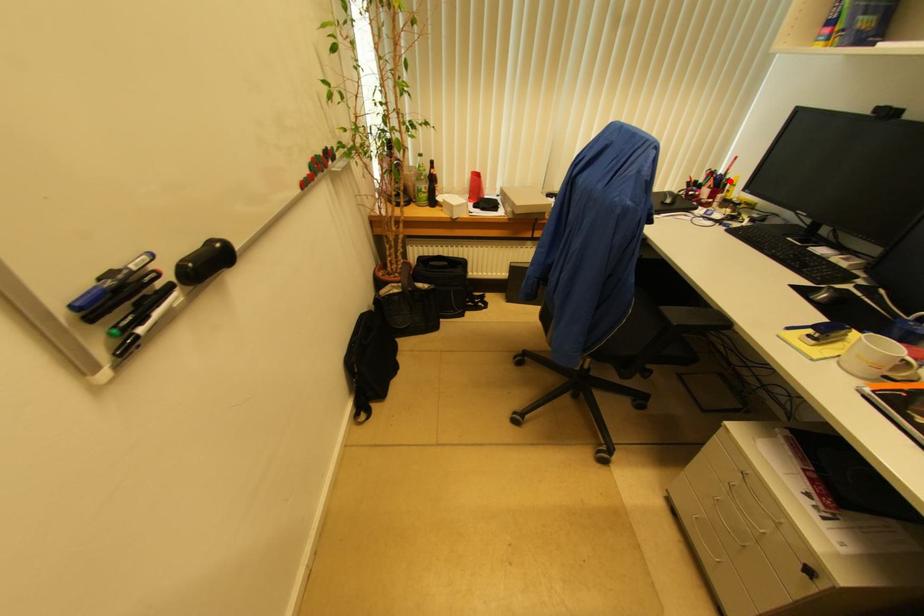
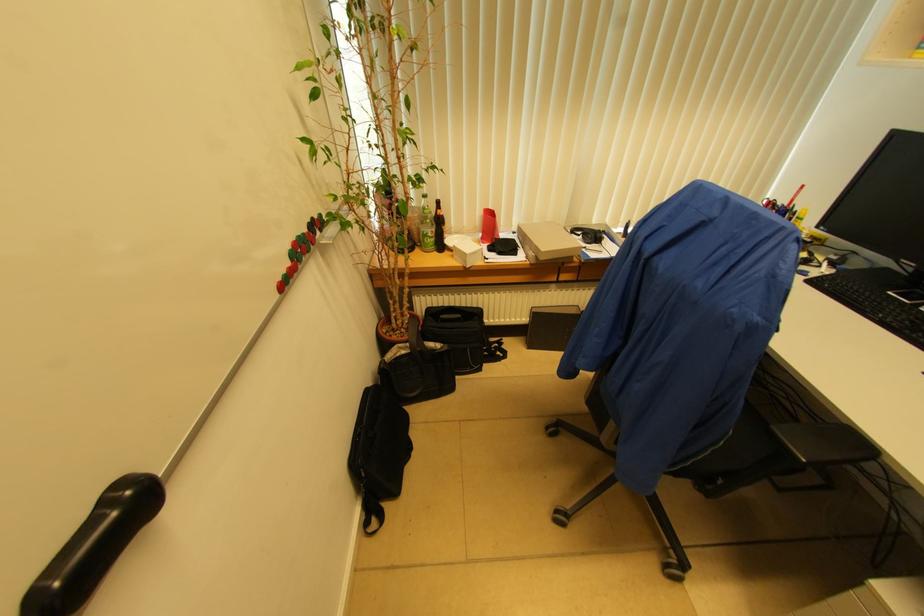
Question: I am providing you with two images of the same scene from different viewpoints. In image1, a red point is highlighted. Considering the same 3D point in image2, which of the following is correct?

Choices:
 (A) It is closer
 (B) It is farther

Answer: (B)